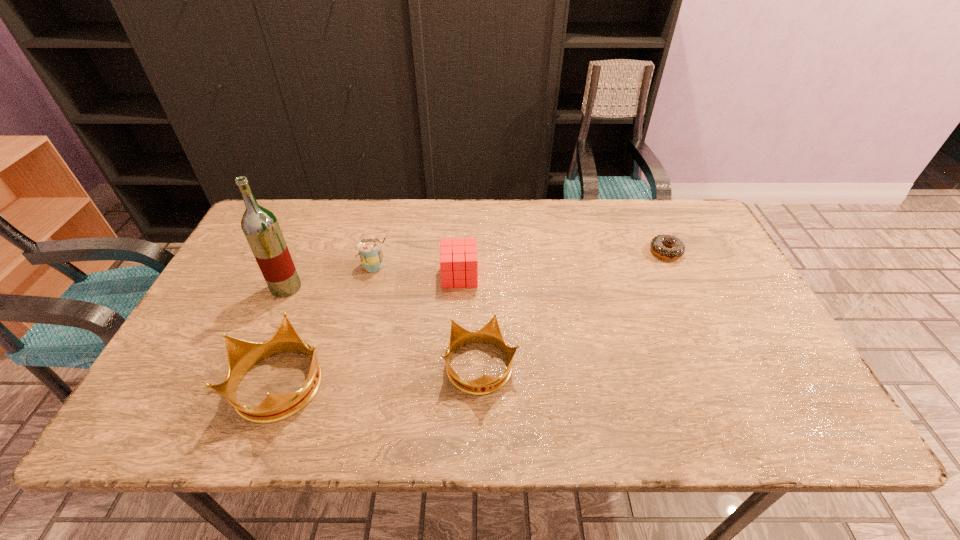
At what (x,y) coordinates should I click in order to perform the action: click on the taller crown. Please return your answer as a coordinate pair (x, y). The width and height of the screenshot is (960, 540). Looking at the image, I should click on (242, 355).

The height and width of the screenshot is (540, 960). I want to click on the shorter crown, so click(490, 333).

Locate an element on the screen. liquor is located at coordinates (260, 226).

The height and width of the screenshot is (540, 960). In order to click on cube in this screenshot , I will do `click(458, 263)`.

Where is `the fourth object from right to left`? The image size is (960, 540). the fourth object from right to left is located at coordinates (369, 248).

Find the location of a particular element. the shortest object is located at coordinates (658, 243).

The image size is (960, 540). What are the coordinates of `doughnut` in the screenshot? It's located at (658, 243).

Image resolution: width=960 pixels, height=540 pixels. In order to click on free space located 0.270m on the back of the left crown in this screenshot , I will do `click(324, 269)`.

What are the coordinates of `vacant space located 0.250m on the left of the shorter crown` in the screenshot? It's located at (337, 368).

This screenshot has width=960, height=540. Identify the location of vacant region located on the back of the liquor. (303, 248).